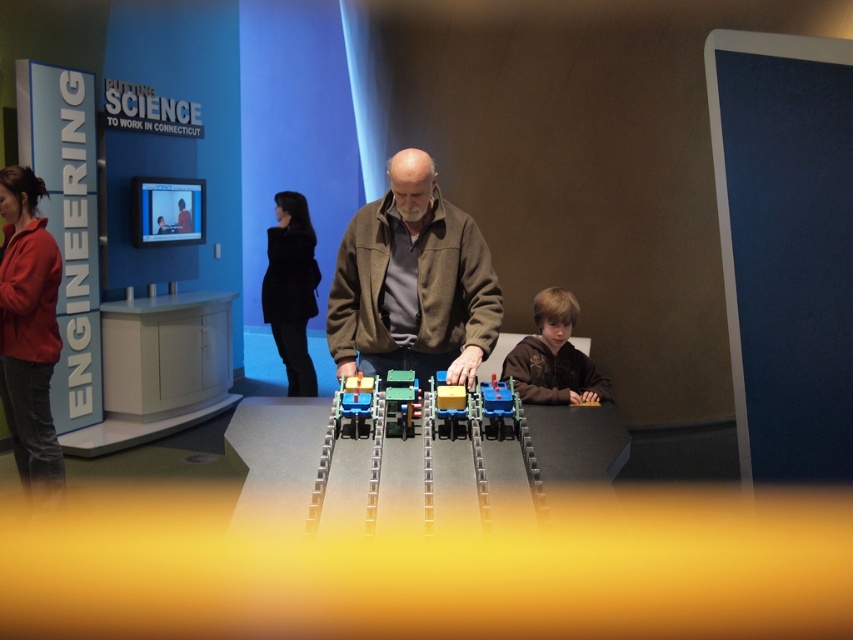
Question: Estimate the real-world distances between objects in this image. Which object is farther from the translucent plastic table at center?

Choices:
 (A) blue plastic toy car at center
 (B) brown fuzzy jacket at lower right
 (C) translucent plastic train car at center
 (D) matte plastic toy at center

Answer: (B)

Question: Which point appears farthest from the camera in this image?

Choices:
 (A) (296, 484)
 (B) (508, 380)
 (C) (433, 308)

Answer: (C)

Question: Where is brown matte jacket at center located in relation to translucent plastic train car at center in the image?

Choices:
 (A) below
 (B) above

Answer: (B)

Question: Is translucent plastic table at center smaller than matte plastic toy at center?

Choices:
 (A) no
 (B) yes

Answer: (A)

Question: Which object is the closest to the blue plastic toy car at center?

Choices:
 (A) brown matte jacket at center
 (B) translucent plastic train car at center

Answer: (B)

Question: Is brown fuzzy jacket at lower right to the left of blue plastic toy car at center from the viewer's perspective?

Choices:
 (A) no
 (B) yes

Answer: (A)